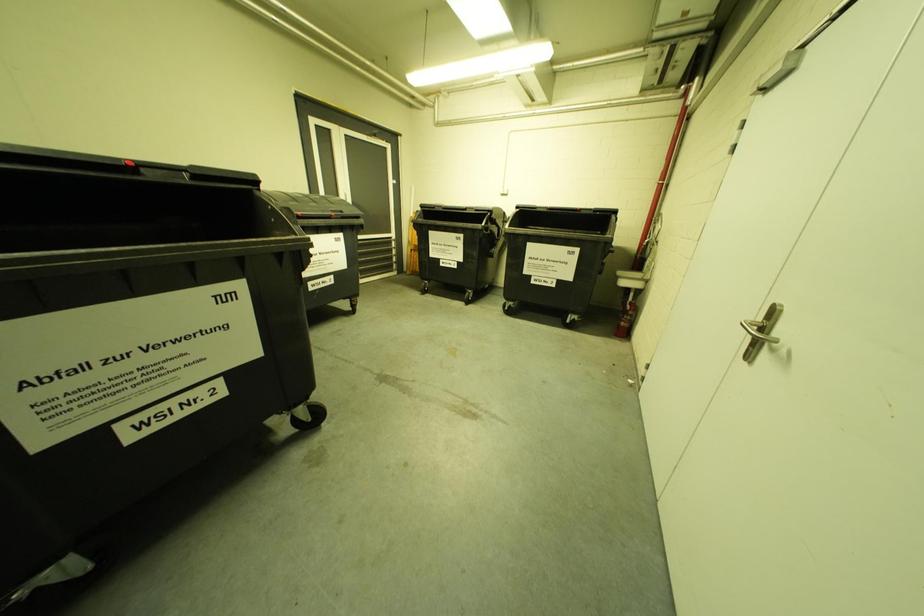
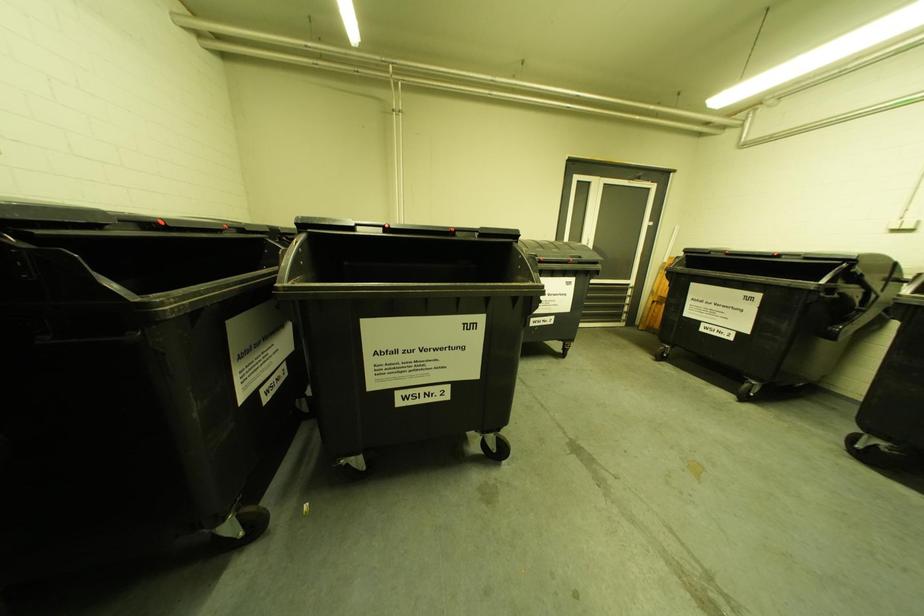
Question: The camera is either moving clockwise (left) or counter-clockwise (right) around the object. The first image is from the beginning of the video and the second image is from the end. Is the camera moving left or right when shooting the video?

Choices:
 (A) Left
 (B) Right

Answer: (B)